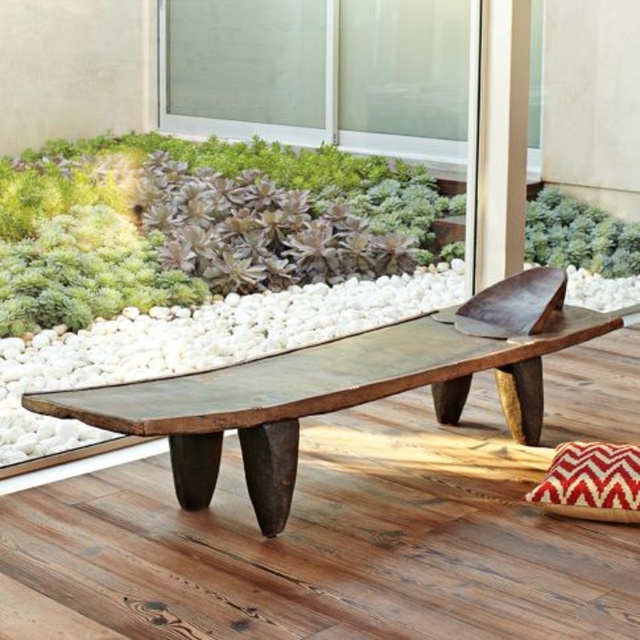
You are arranging a small table between the rustic wood bench at center and the green leafy plant at center. If the table is 1.2 meters wide, will it fit between them?

The rustic wood bench at center is wider than the green leafy plant at center, but the exact distance between them isn

You are an interior designer planning to place a new rug in the room. The rug must be large enough to cover both the rustic wood bench at center and the green leafy plant at center. Given their sizes, will the rug need to be wider than the bench alone?

The rustic wood bench at center has a larger size compared to green leafy plant at center. Since the bench is larger, the rug must be at least as wide as the bench to cover both objects. However, if the plant is positioned near the bench, the total width required would depend on their combined space. Without specific placement details, the safest assumption is that the rug needs to be wider than the bench alone to ensure both are covered.

You are a visitor in this space and want to sit on the rustic wood bench at center. Are you likely to get watered if the green leafy plant at center is being watered from above?

The rustic wood bench at center is positioned under the green leafy plant at center, so yes, sitting there would likely get you wet if the plant is watered from above.